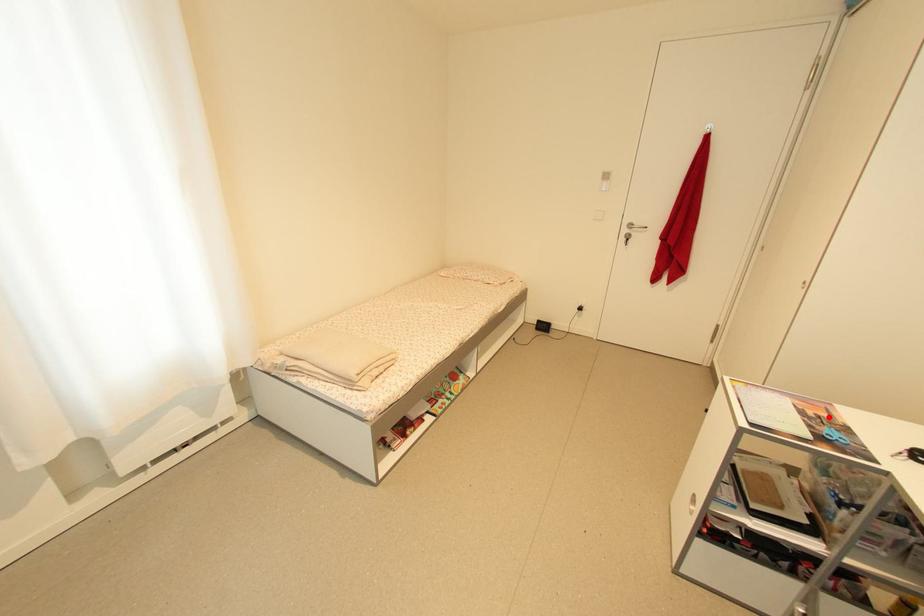
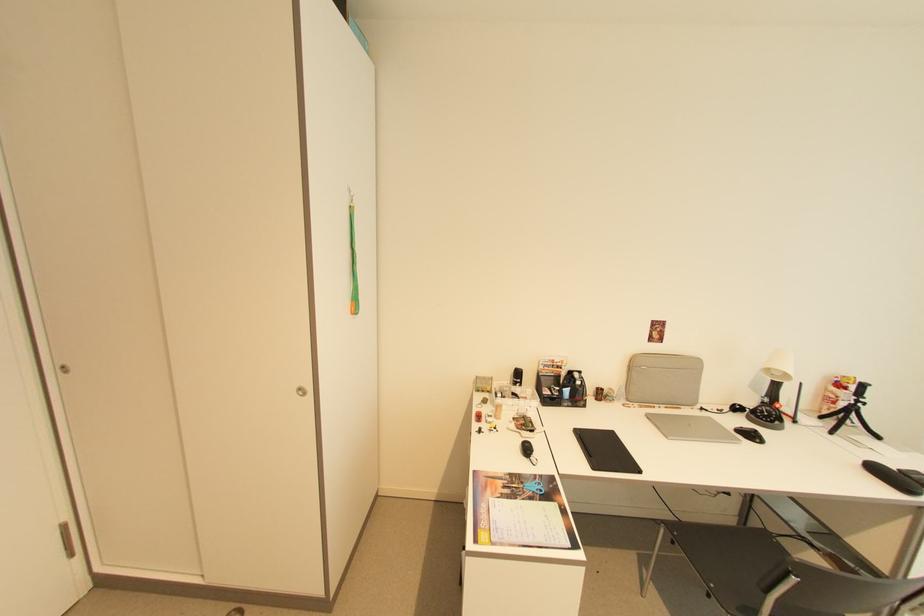
Question: I am providing you with two images of the same scene from different viewpoints. A red point is marked on the first image. Is the red point's position out of view in image 2?

Choices:
 (A) Yes
 (B) No

Answer: (B)